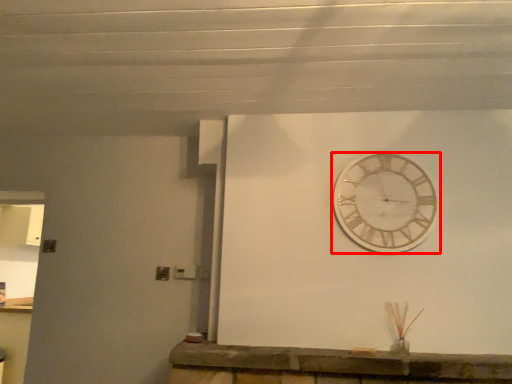
Question: From the image's perspective, considering the relative positions of wall clock (annotated by the red box) and counter in the image provided, where is wall clock (annotated by the red box) located with respect to the staircase?

Choices:
 (A) below
 (B) above

Answer: (B)